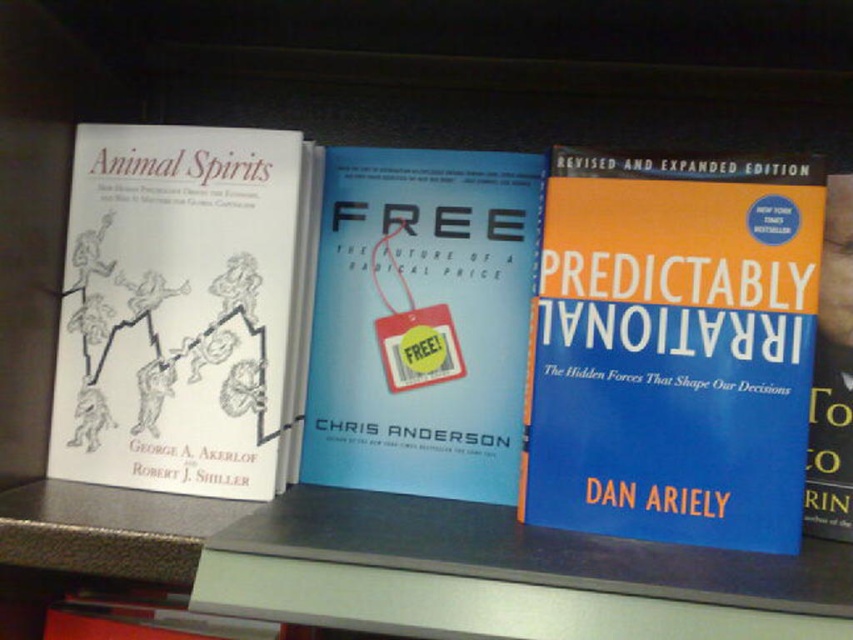
Does blue hardcover book at center appear over blue matte book at center?

Actually, blue hardcover book at center is below blue matte book at center.

Is point (640, 528) less distant than point (374, 193)?

Yes, it is.

Is point (642, 465) in front of point (518, 342)?

Yes, it is.

Locate an element on the screen. This screenshot has height=640, width=853. blue hardcover book at center is located at coordinates click(x=672, y=348).

In the scene shown: Does white paper at left have a smaller size compared to blue matte book at center?

Incorrect, white paper at left is not smaller in size than blue matte book at center.

Is white paper at left further to the viewer compared to blue matte book at center?

No, it is in front of blue matte book at center.

Between point (277, 189) and point (323, 307), which one is positioned behind?

Point (323, 307)

This screenshot has height=640, width=853. Find the location of `white paper at left`. white paper at left is located at coordinates (181, 308).

Which is behind, point (683, 298) or point (160, 205)?

The point (160, 205) is more distant.

Where is `blue hardcover book at center`? blue hardcover book at center is located at coordinates (672, 348).